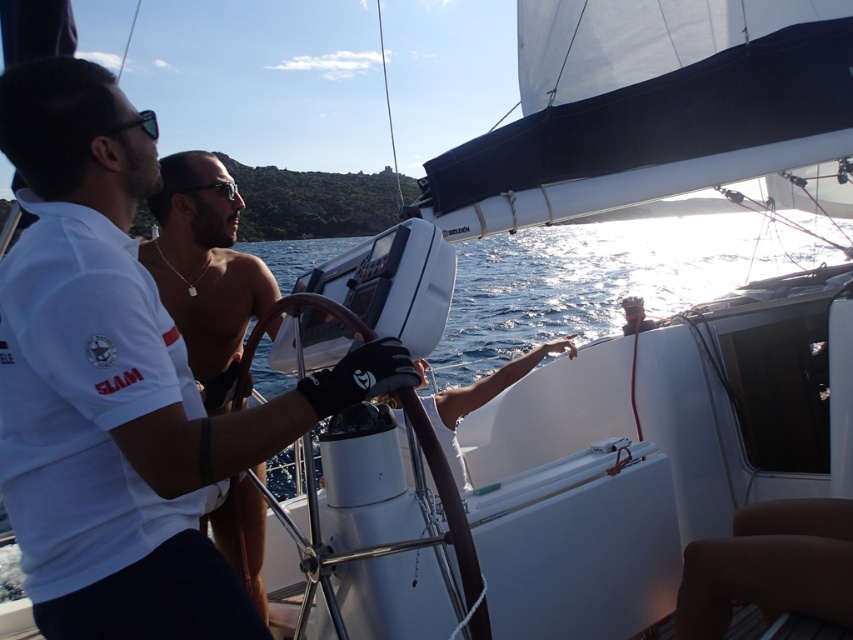
Locate an element on the screen. white matte shirt at center is located at coordinates (119, 385).

Between white matte shirt at center and shiny black sunglasses at center, which one is positioned higher?

Positioned higher is shiny black sunglasses at center.

Does white matte shirt at center have a smaller size compared to shiny black sunglasses at center?

Yes.

Is point (68, 164) less distant than point (228, 548)?

Yes, it is in front of point (228, 548).

This screenshot has width=853, height=640. In order to click on white matte shirt at center in this screenshot , I will do `click(119, 385)`.

Describe the element at coordinates (204, 269) in the screenshot. This screenshot has height=640, width=853. I see `shiny black sunglasses at center` at that location.

Can you confirm if shiny black sunglasses at center is taller than black plastic goggles at center?

Yes.

Which is in front, point (218, 317) or point (199, 186)?

Point (199, 186)

Where is `shiny black sunglasses at center`? shiny black sunglasses at center is located at coordinates (204, 269).